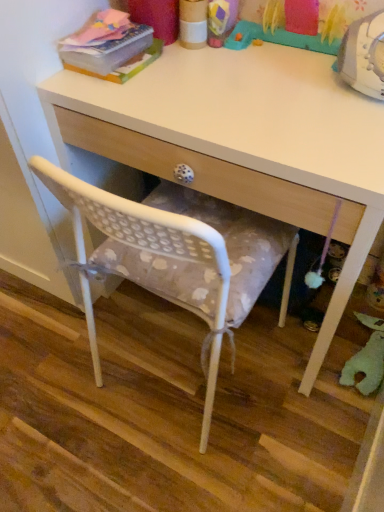
Locate an element on the screen. This screenshot has width=384, height=512. free spot in front of matte pink book at upper left is located at coordinates (123, 95).